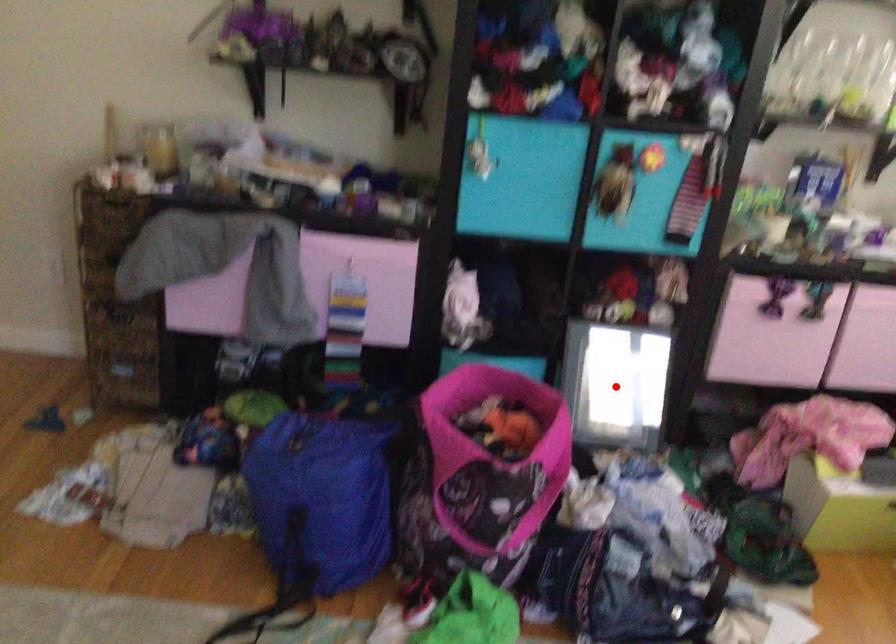
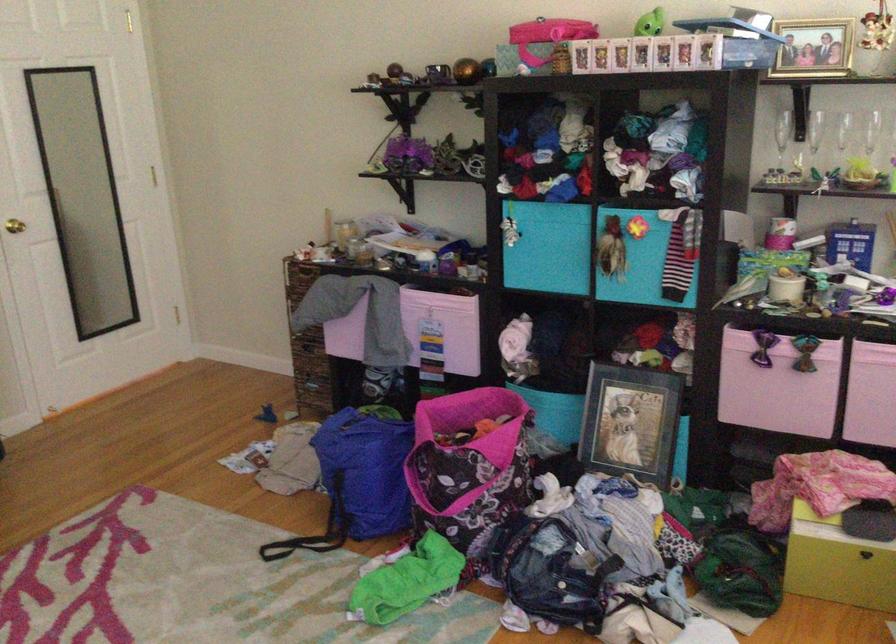
In the second image, find the point that corresponds to the highlighted location in the first image.

(631, 422)